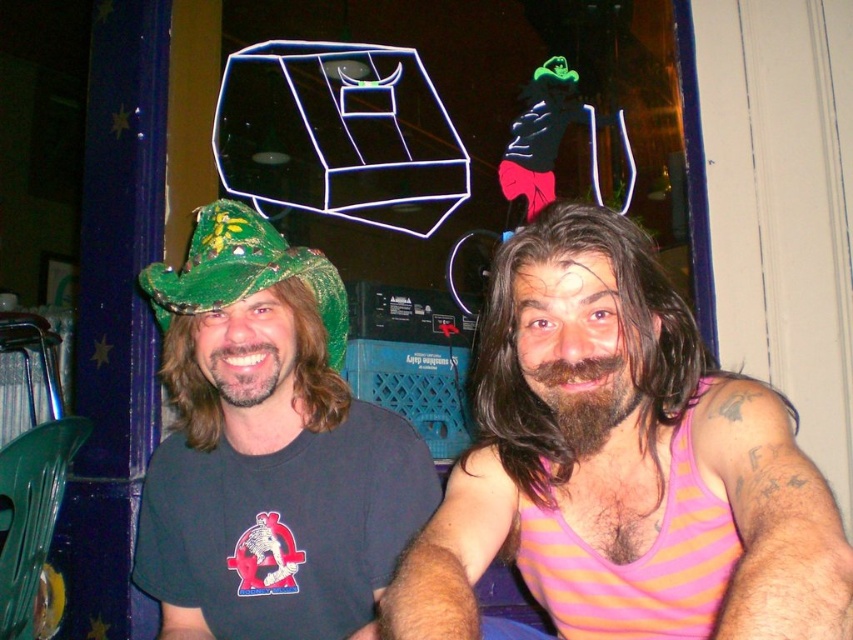
You are standing in front of the two people in the photo. You want to throw a small ball to the person closer to you. Which point should you aim for, point 1 at coordinates (328, 436) or point 2 at coordinates (270, 225)?

Point 1 at coordinates (328, 436) is closer to the viewer, so you should aim for point 1 at coordinates (328, 436).

You are standing in the scene and want to place a small sticker on the point that is closer to the camera. Which point should you choose between point [798,509] and point [305,525]?

Point [798,509] is in front of point [305,525], so you should place the sticker on point [798,509] since it is closer to the camera.